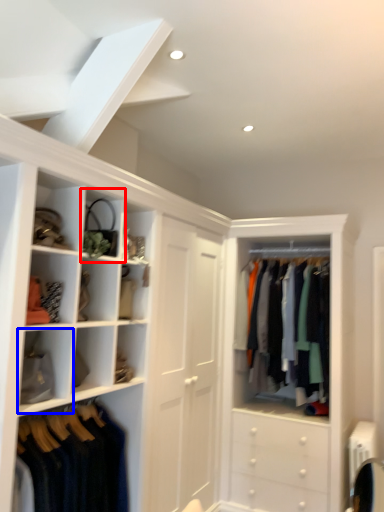
Question: Which of the following is the closest to the observer, cabinet (highlighted by a red box) or cabinet (highlighted by a blue box)?

Choices:
 (A) cabinet
 (B) cabinet

Answer: (B)